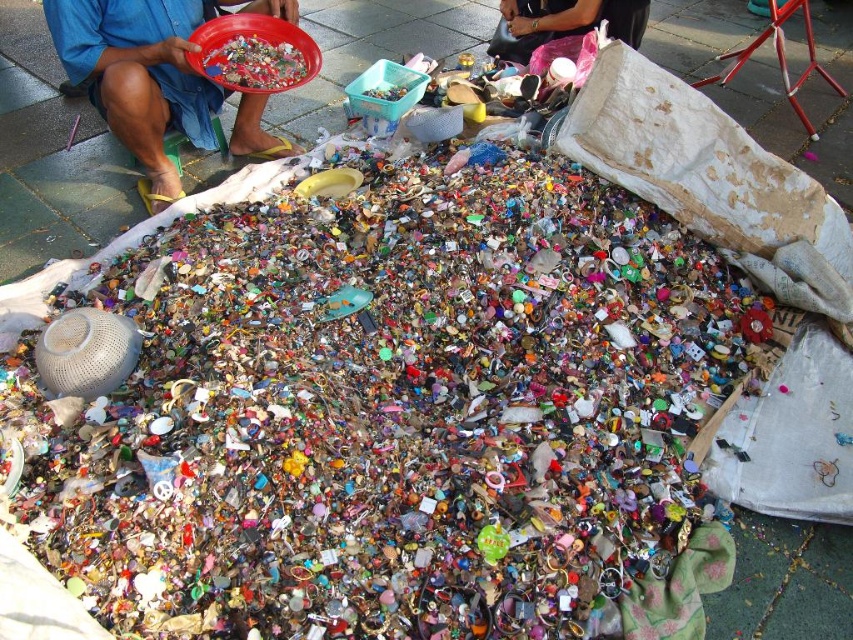
Question: Among these points, which one is farthest from the camera?

Choices:
 (A) (495, 38)
 (B) (160, 125)

Answer: (A)

Question: Which point appears closest to the camera in this image?

Choices:
 (A) (96, 106)
 (B) (511, 45)

Answer: (A)

Question: Does blue denim shorts at upper left have a smaller size compared to matte black bag at upper center?

Choices:
 (A) yes
 (B) no

Answer: (B)

Question: Which of the following is the farthest from the observer?

Choices:
 (A) blue denim shorts at upper left
 (B) matte black bag at upper center

Answer: (B)

Question: Does blue denim shorts at upper left have a greater width compared to matte black bag at upper center?

Choices:
 (A) yes
 (B) no

Answer: (A)

Question: Considering the relative positions of blue denim shorts at upper left and matte black bag at upper center in the image provided, where is blue denim shorts at upper left located with respect to matte black bag at upper center?

Choices:
 (A) right
 (B) left

Answer: (B)